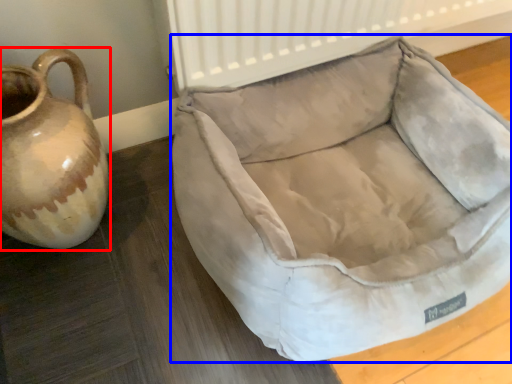
Question: Which object is closer to the camera taking this photo, jug (highlighted by a red box) or dog bed (highlighted by a blue box)?

Choices:
 (A) jug
 (B) dog bed

Answer: (B)